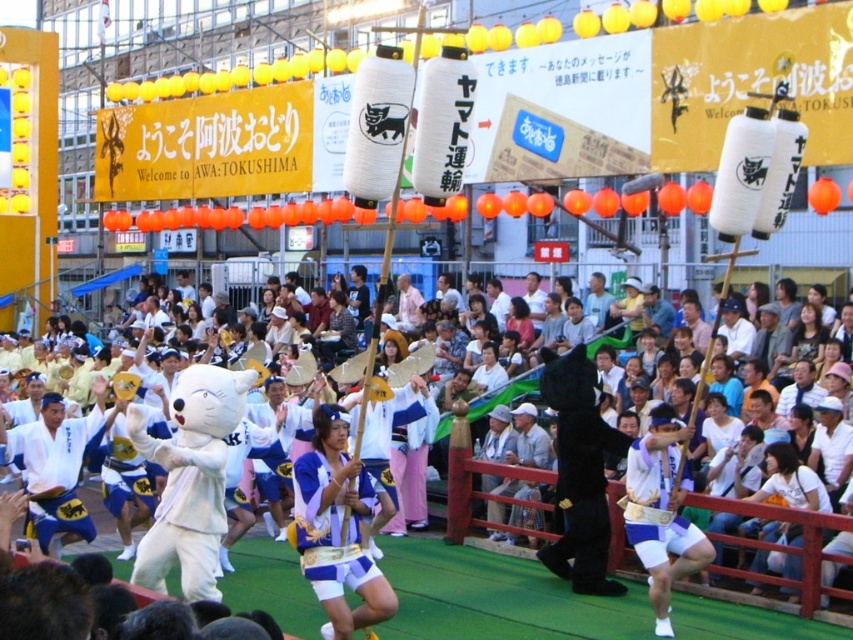
Question: Is white plush mascot at center closer to the viewer compared to blue fabric costume at center?

Choices:
 (A) no
 (B) yes

Answer: (B)

Question: Among these points, which one is farthest from the camera?

Choices:
 (A) (360, 493)
 (B) (407, 292)
 (C) (641, 502)

Answer: (B)

Question: Which point is farther to the camera?

Choices:
 (A) white fabric mask at center
 (B) white plush mascot at center
 (C) white cotton kimono at center

Answer: (C)

Question: Which of these objects is positioned farthest from the white plush mascot at center?

Choices:
 (A) white fabric mask at center
 (B) blue fabric costume at center
 (C) white cotton kimono at center

Answer: (C)

Question: Is blue fabric costume at center bigger than white cotton kimono at center?

Choices:
 (A) yes
 (B) no

Answer: (B)

Question: In this image, where is white plush mascot at center located relative to blue fabric costume at center?

Choices:
 (A) above
 (B) below

Answer: (B)